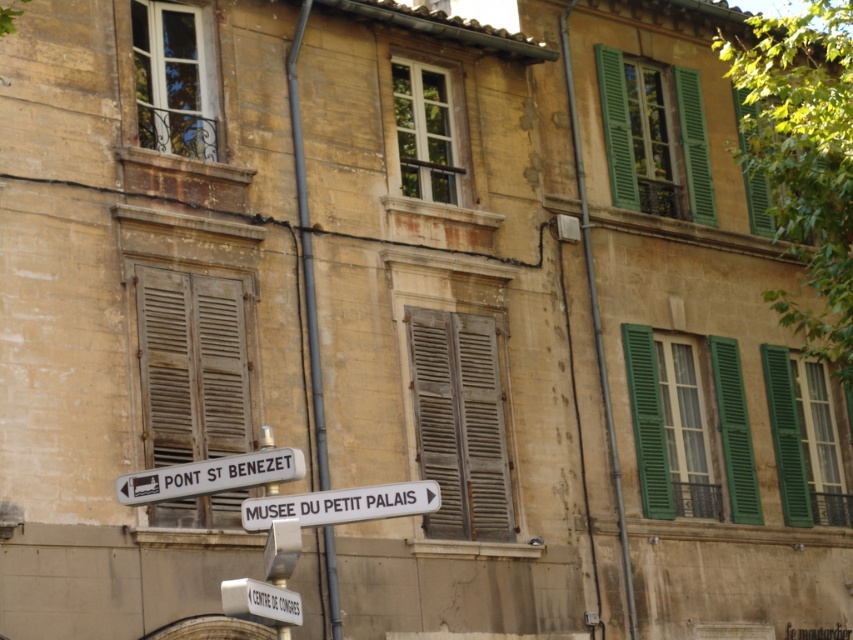
Question: Among these points, which one is farthest from the camera?

Choices:
 (A) (218, 280)
 (B) (828, 522)
 (C) (345, 502)

Answer: (B)

Question: Which object appears closest to the camera in this image?

Choices:
 (A) wooden shutters at left
 (B) green wooden shutters at right
 (C) metallic pipe at center

Answer: (C)

Question: Among these objects, which one is farthest from the camera?

Choices:
 (A) white plastic sign at lower center
 (B) metallic pipe at center

Answer: (B)

Question: Does wooden shutters at left appear on the right side of wooden at center?

Choices:
 (A) yes
 (B) no

Answer: (B)

Question: Is wooden shutters at left closer to camera compared to wooden at center?

Choices:
 (A) yes
 (B) no

Answer: (A)

Question: Is wooden shutters at left bigger than green wooden shutters at right?

Choices:
 (A) yes
 (B) no

Answer: (A)